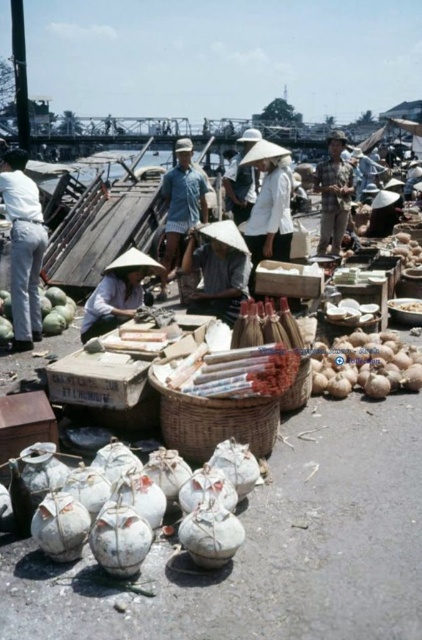
Question: Which point is farther to the camera?

Choices:
 (A) denim shirt at center
 (B) matte straw hat at center
 (C) smooth brown coconuts at center

Answer: (A)

Question: Is matte white conical hat at center wider than checkered fabric shirt at center?

Choices:
 (A) no
 (B) yes

Answer: (A)

Question: Which object is positioned closest to the denim shirt at center?

Choices:
 (A) matte white conical hat at center
 (B) white cotton pants at left

Answer: (B)

Question: Which point is farther to the camera?

Choices:
 (A) click(324, 188)
 (B) click(5, 308)
 (C) click(184, 268)
 (D) click(119, 282)

Answer: (A)

Question: Does smooth brown coconuts at center have a smaller size compared to denim shirt at center?

Choices:
 (A) yes
 (B) no

Answer: (B)

Question: Is white cotton pants at left to the right of denim shirt at center from the viewer's perspective?

Choices:
 (A) no
 (B) yes

Answer: (A)